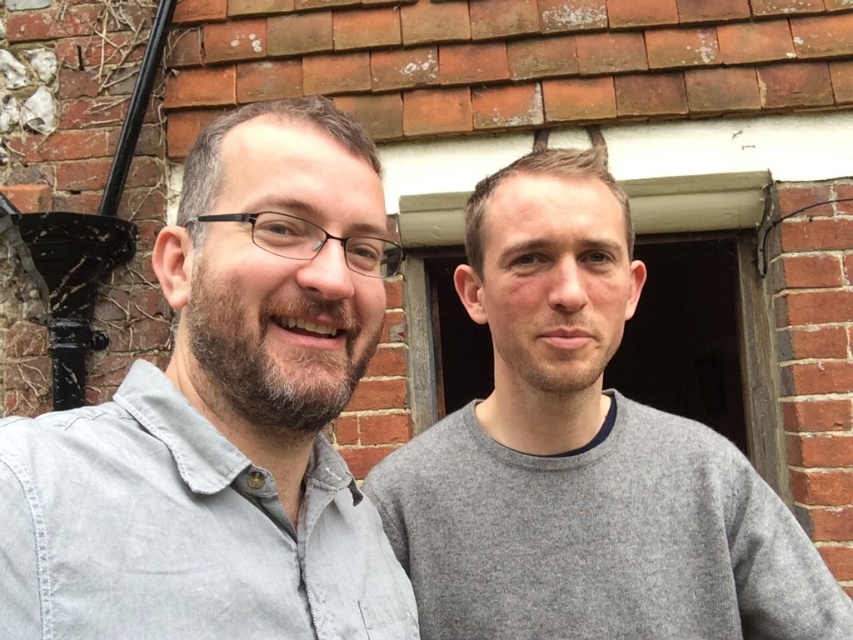
Is gray cotton shirt at left thinner than gray wool sweater at right?

Yes, gray cotton shirt at left is thinner than gray wool sweater at right.

Which is above, gray cotton shirt at left or gray wool sweater at right?

gray cotton shirt at left is above.

Describe the element at coordinates (224, 417) in the screenshot. I see `gray cotton shirt at left` at that location.

Where is `gray cotton shirt at left`? gray cotton shirt at left is located at coordinates (224, 417).